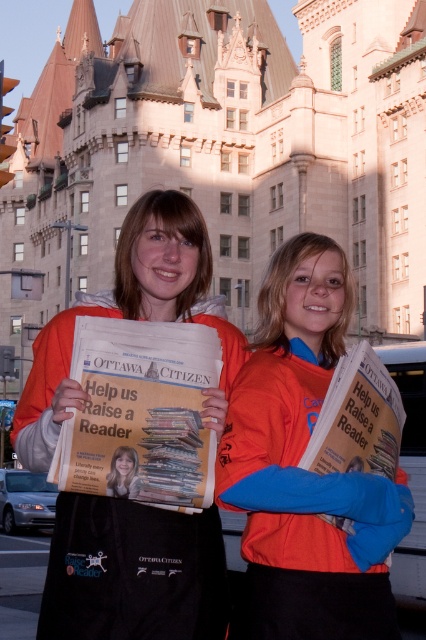
Question: Which point is farther from the camera taking this photo?

Choices:
 (A) 259,509
 (B) 186,518

Answer: (B)

Question: Which of the following is the farthest from the observer?

Choices:
 (A) orange fabric jacket at center
 (B) orange fleece jacket at center

Answer: (A)

Question: Is orange fabric jacket at center thinner than orange fleece jacket at center?

Choices:
 (A) no
 (B) yes

Answer: (B)

Question: Does orange fabric jacket at center have a lesser width compared to orange fleece jacket at center?

Choices:
 (A) no
 (B) yes

Answer: (B)

Question: Which object is closer to the camera taking this photo?

Choices:
 (A) orange fabric jacket at center
 (B) orange fleece jacket at center

Answer: (B)

Question: Is orange fabric jacket at center to the right of orange fleece jacket at center from the viewer's perspective?

Choices:
 (A) no
 (B) yes

Answer: (B)